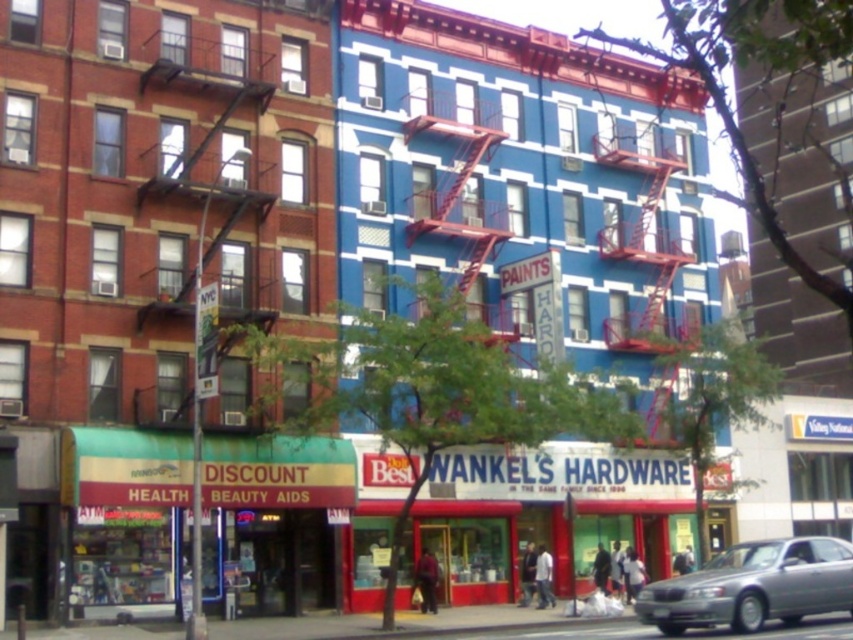
You are a delivery person who needs to park your silver metallic car at lower right in a spot that is exactly the same width as the car. There is a parking space next to the green fabric health aid store at lower left. Can you fit your car into that space?

The green fabric health aid store at lower left might be wider than the silver metallic car at lower right, so there is a possibility that the parking space next to it is wide enough to accommodate the car. However, since the exact width difference is uncertain, it is recommended to measure the space before attempting to park.

You are a pedestrian standing on the sidewalk in front of the two buildings. You need to locate the green fabric health aid store at lower left and the silver metallic car at lower right. Which one is positioned higher up from the ground level?

The green fabric health aid store at lower left is located above the silver metallic car at lower right, so it is positioned higher up from the ground level.